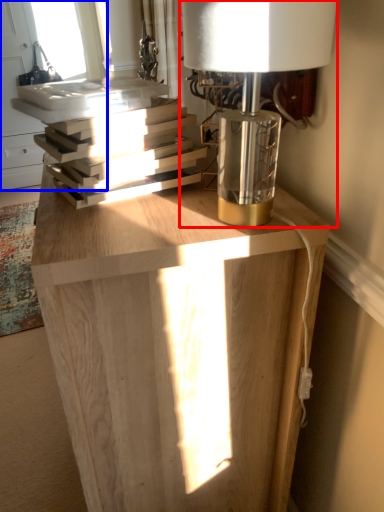
Question: Which object is further to the camera taking this photo, lamp (highlighted by a red box) or window (highlighted by a blue box)?

Choices:
 (A) lamp
 (B) window

Answer: (B)